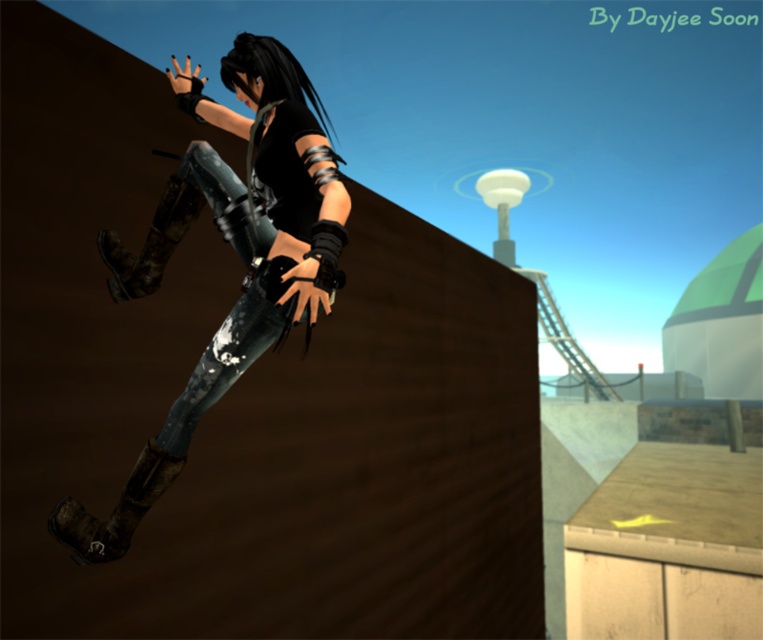
Question: Is denim jeans at left to the left of camouflage fabric boot at left from the viewer's perspective?

Choices:
 (A) no
 (B) yes

Answer: (A)

Question: Among these points, which one is nearest to the camera?

Choices:
 (A) (66, 500)
 (B) (198, 212)
 (C) (79, 515)

Answer: (A)

Question: Which object is closer to the camera taking this photo?

Choices:
 (A) muddy leather boot at lower left
 (B) camouflage fabric boot at left

Answer: (A)

Question: Considering the relative positions of denim jeans at left and camouflage fabric boot at left in the image provided, where is denim jeans at left located with respect to camouflage fabric boot at left?

Choices:
 (A) above
 (B) below

Answer: (B)

Question: Among these points, which one is nearest to the camera?

Choices:
 (A) (308, 317)
 (B) (163, 480)
 (C) (130, 285)

Answer: (A)

Question: Can you confirm if muddy leather boot at lower left is smaller than camouflage fabric boot at left?

Choices:
 (A) no
 (B) yes

Answer: (B)